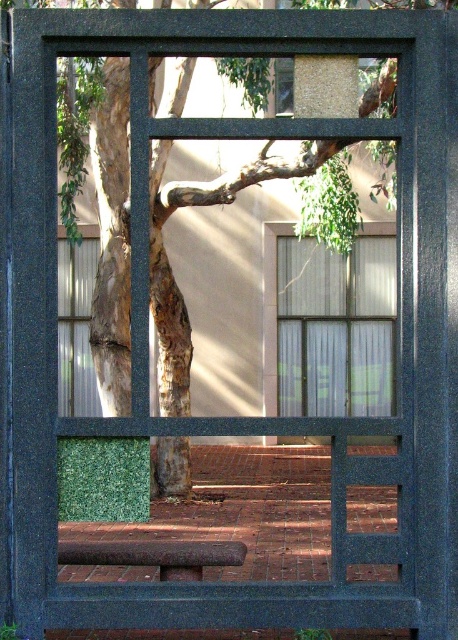
Question: Is clear glass window at center below rustic wood bench at lower center?

Choices:
 (A) yes
 (B) no

Answer: (B)

Question: Is clear glass window at center to the left of rustic wood bench at lower center from the viewer's perspective?

Choices:
 (A) yes
 (B) no

Answer: (B)

Question: Among these objects, which one is farthest from the camera?

Choices:
 (A) clear glass window at center
 (B) rustic wood bench at lower center

Answer: (A)

Question: Which point is farther to the camera?

Choices:
 (A) (345, 330)
 (B) (187, 541)

Answer: (A)

Question: Is clear glass window at center further to the viewer compared to rustic wood bench at lower center?

Choices:
 (A) no
 (B) yes

Answer: (B)